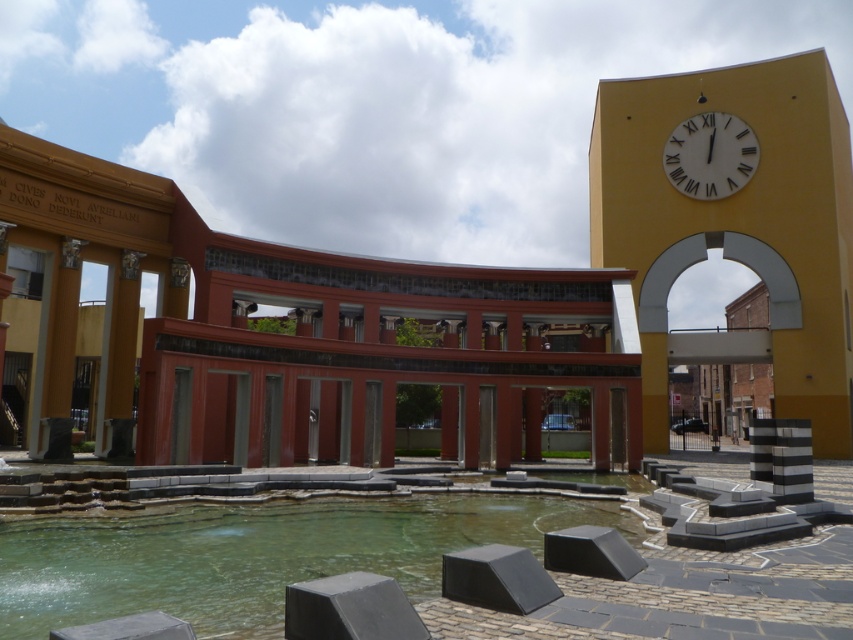
You are an architect reviewing blueprints and notice two clock features on the upper right side of the building facade. The yellow matte clock tower at upper right and the white matte clock at upper right. According to the description, which one is positioned lower?

The yellow matte clock tower at upper right is below the white matte clock at upper right, so it is positioned lower.